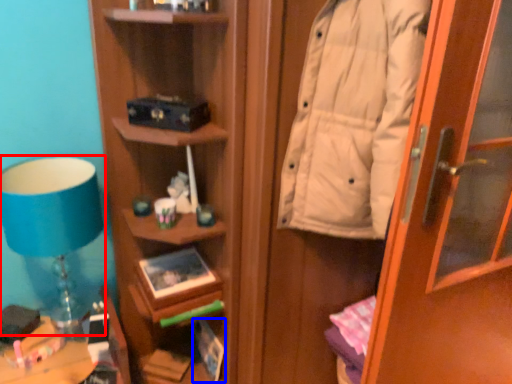
Question: Which object appears farthest to the camera in this image, table lamp (highlighted by a red box) or book (highlighted by a blue box)?

Choices:
 (A) table lamp
 (B) book

Answer: (B)